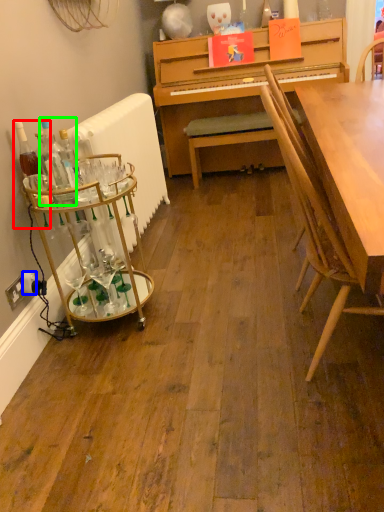
Question: Based on their relative distances, which object is farther from bottle (highlighted by a red box)? Choose from power outlet (highlighted by a blue box) and bottle (highlighted by a green box).

Choices:
 (A) power outlet
 (B) bottle

Answer: (A)